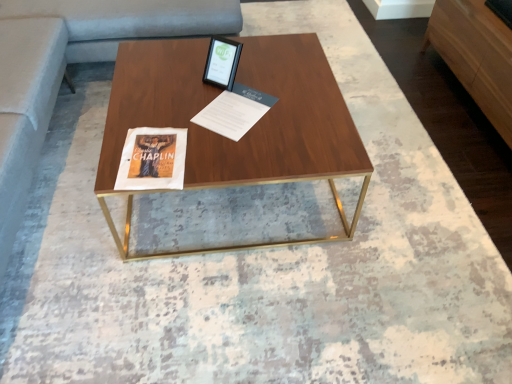
Question: From the image's perspective, is white paper at center positioned above or below light brown wood dresser at right?

Choices:
 (A) above
 (B) below

Answer: (B)

Question: Which is correct: white paper at center is inside light brown wood dresser at right, or outside of it?

Choices:
 (A) inside
 (B) outside

Answer: (B)

Question: Which object is positioned closest to the walnut wood coffee table at center?

Choices:
 (A) light brown wood dresser at right
 (B) matte black tablet at upper center
 (C) white paper at center

Answer: (C)

Question: Estimate the real-world distances between objects in this image. Which object is closer to the walnut wood coffee table at center?

Choices:
 (A) white paper at center
 (B) matte black tablet at upper center
 (C) light brown wood dresser at right

Answer: (A)